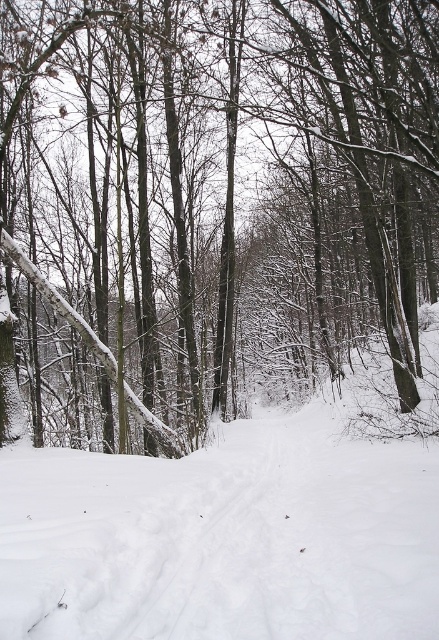
Question: Is snow-covered tree at center smaller than white powdery snow at center?

Choices:
 (A) yes
 (B) no

Answer: (B)

Question: Does snow-covered tree at center appear under white powdery snow at center?

Choices:
 (A) yes
 (B) no

Answer: (B)

Question: Which object is closer to the camera taking this photo?

Choices:
 (A) snow-covered tree at center
 (B) white powdery snow at center

Answer: (B)

Question: Does snow-covered tree at center appear on the left side of white powdery snow at center?

Choices:
 (A) yes
 (B) no

Answer: (A)

Question: Which point is farther to the camera?

Choices:
 (A) (154, 444)
 (B) (72, 628)

Answer: (A)

Question: Which point is farther from the camera taking this photo?

Choices:
 (A) (177, 634)
 (B) (32, 218)

Answer: (B)